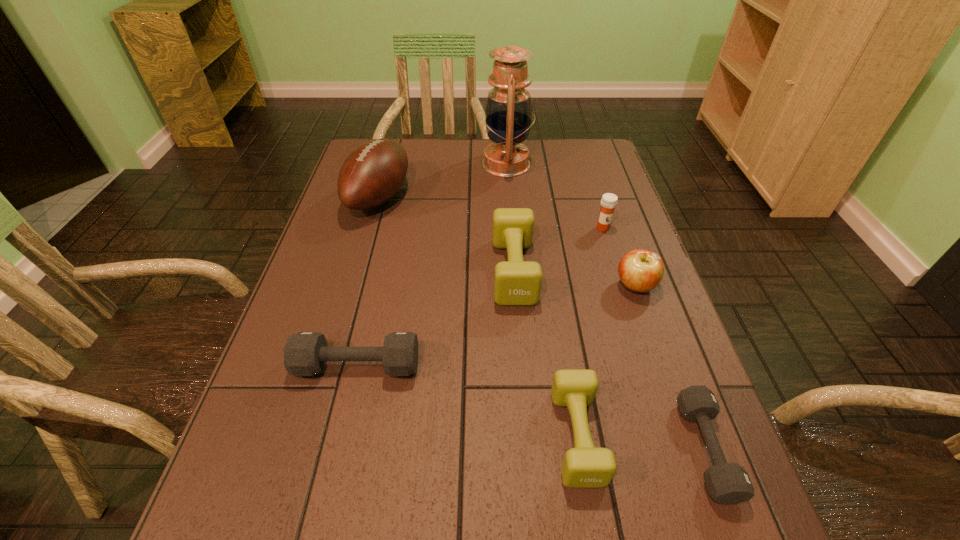
Locate an element on the screen. vacant space at the far edge is located at coordinates (471, 159).

I want to click on free location at the left edge, so click(356, 228).

Where is `vacant space at the right edge of the desktop`? vacant space at the right edge of the desktop is located at coordinates (640, 384).

Image resolution: width=960 pixels, height=540 pixels. Identify the location of vacant space at the far right corner of the desktop. (584, 161).

Where is `empty location between the farther olive dumbbell and the second tallest object`? The height and width of the screenshot is (540, 960). empty location between the farther olive dumbbell and the second tallest object is located at coordinates (446, 234).

Find the location of a particular element. Image resolution: width=960 pixels, height=540 pixels. free spot between the apple and the blue oil lamp is located at coordinates (571, 225).

This screenshot has height=540, width=960. Identify the location of free space between the leftmost dumbbell and the oil lamp. (432, 265).

Identify the location of blank region between the right olive dumbbell and the second farthest dumbbell. The width and height of the screenshot is (960, 540). (468, 401).

Find the location of `empty location between the tallest object and the football (American)`. empty location between the tallest object and the football (American) is located at coordinates (443, 181).

At what (x,y) coordinates should I click in order to perform the action: click on vacant area between the rightmost dumbbell and the leftmost dumbbell. Please return your answer as a coordinate pair (x, y). Looking at the image, I should click on (532, 407).